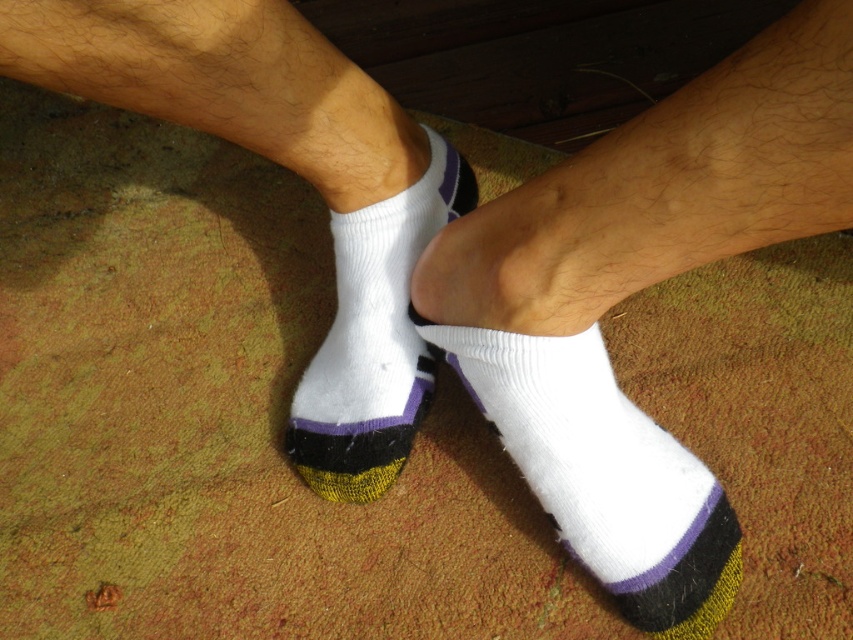
You are a photographer adjusting your camera settings to capture a detailed shot of the white fabric sock at center. If your camera has a minimum focusing distance of 28 inches, will you need to move closer or farther away to ensure the sock is in focus?

The white fabric sock at center is 27.77 inches away from the viewer. Since the camera requires a minimum focusing distance of 28 inches, you need to move slightly farther away to reach the required distance for clear focus.

You are standing in a room and see two white socks at the center of the image. One is labeled as white knitted socks at center and the other as white knit sock at center. Which one is closer to you?

The white knitted socks at center is closer to you because it is in front of the white knit sock at center.